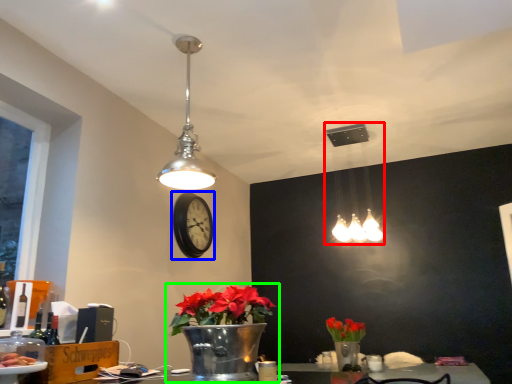
Question: Considering the real-world distances, which object is closest to lamp (highlighted by a red box)? clock (highlighted by a blue box) or houseplant (highlighted by a green box).

Choices:
 (A) clock
 (B) houseplant

Answer: (A)